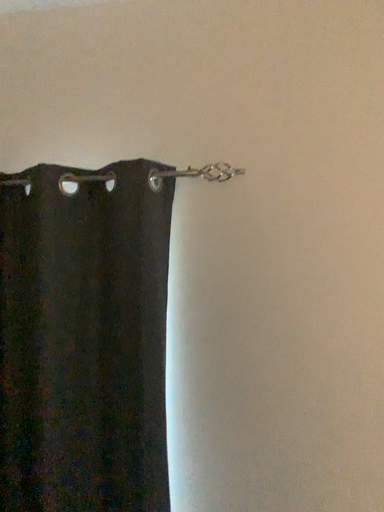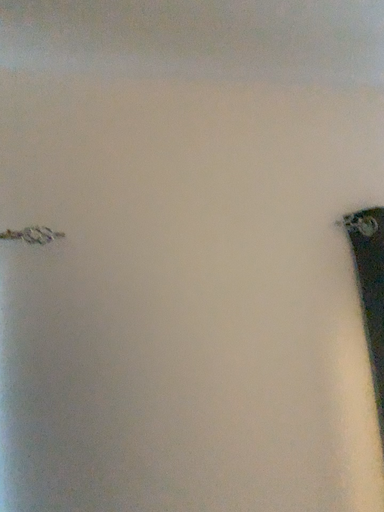
Question: Which way did the camera rotate in the video?

Choices:
 (A) rotated left
 (B) rotated right

Answer: (B)